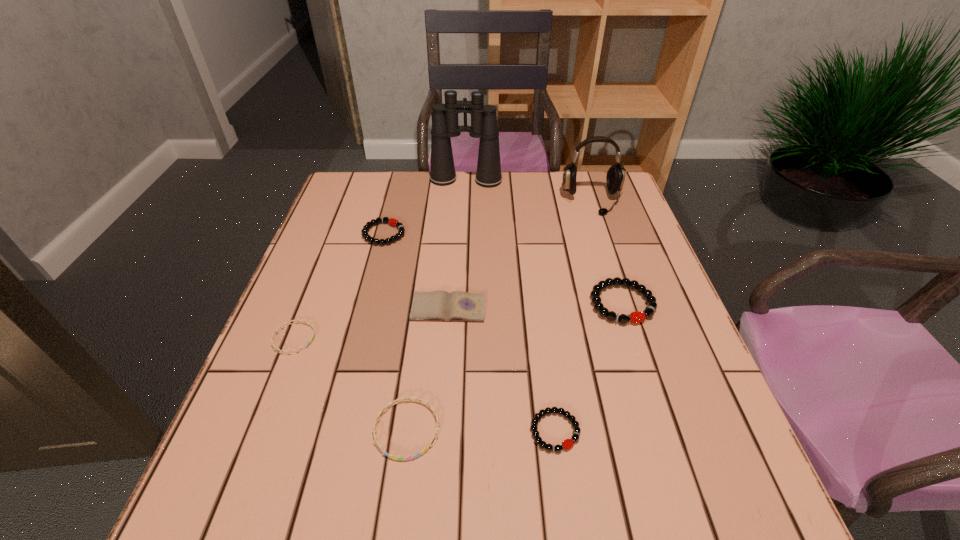
The height and width of the screenshot is (540, 960). What are the coordinates of `vacant space located 0.150m on the surface of the shortest object showing star-shaped elements` in the screenshot? It's located at (385, 339).

The height and width of the screenshot is (540, 960). I want to click on binoculars positioned at the far edge, so click(484, 125).

The image size is (960, 540). Find the location of `headset located at the far edge`. headset located at the far edge is located at coordinates (615, 177).

Image resolution: width=960 pixels, height=540 pixels. I want to click on headset located in the right edge section of the desktop, so click(x=615, y=177).

You are a GUI agent. You are given a task and a screenshot of the screen. Output one action in this format:
    pyautogui.click(x=<x>, y=<y>)
    Task: Click on the bracelet that is at the right edge
    This screenshot has width=960, height=540.
    Given the screenshot: What is the action you would take?
    pyautogui.click(x=636, y=317)

You are a GUI agent. You are given a task and a screenshot of the screen. Output one action in this format:
    pyautogui.click(x=<x>, y=<y>)
    Task: Click on the object present at the far right corner
    
    Given the screenshot: What is the action you would take?
    pyautogui.click(x=615, y=177)

Image resolution: width=960 pixels, height=540 pixels. I want to click on vacant area at the far edge, so click(x=503, y=214).

Locate an element on the screen. blank space at the left edge of the desktop is located at coordinates (351, 280).

You are a GUI agent. You are given a task and a screenshot of the screen. Output one action in this format:
    pyautogui.click(x=<x>, y=<y>)
    Task: Click on the vacant space at the right edge
    The image size is (960, 540).
    Given the screenshot: What is the action you would take?
    pyautogui.click(x=660, y=380)

Where is `vacant area at the far left corner of the desktop`? The width and height of the screenshot is (960, 540). vacant area at the far left corner of the desktop is located at coordinates (376, 181).